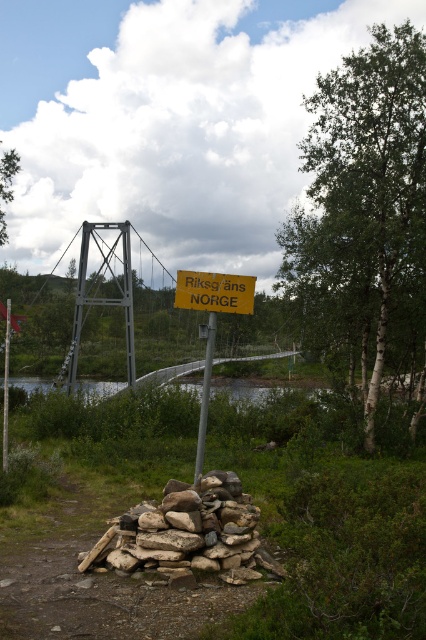
Question: Which of these objects is positioned closest to the yellow matte sign at center?

Choices:
 (A) clear water at center
 (B) silver metallic pole at center

Answer: (B)

Question: Which of the following is the farthest from the observer?

Choices:
 (A) (190, 296)
 (B) (204, 368)
 (C) (131, 541)
 (D) (199, 392)

Answer: (D)

Question: Does rough textured stones at center have a greater width compared to clear water at center?

Choices:
 (A) no
 (B) yes

Answer: (A)

Question: In this image, where is yellow paper sign at center located relative to silver metallic pole at center?

Choices:
 (A) above
 (B) below

Answer: (A)

Question: Is the position of rough textured stones at center less distant than that of yellow paper sign at center?

Choices:
 (A) no
 (B) yes

Answer: (B)

Question: Which object is farther from the camera taking this photo?

Choices:
 (A) rough textured stones at center
 (B) yellow paper sign at center

Answer: (B)